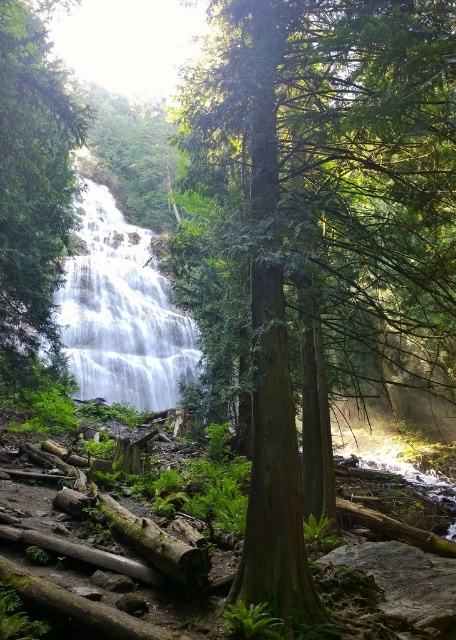
You are a hiker who wants to take a photo of the green smooth tree at center. To avoid getting wet from the white smooth waterfall at center, where should you stand relative to the tree?

The green smooth tree at center is positioned under the white smooth waterfall at center, so to avoid getting wet, you should stand behind the tree or to the side of it, away from the waterfall spray.

You are a hiker standing at the edge of the forest, looking at the green smooth tree at center. If you want to take a photo of it, will you need to zoom in or zoom out your camera to focus on the tree?

The green smooth tree at center is 3.24 meters away from you. Since this distance is relatively close, you would need to zoom out to focus on the entire tree without cropping it out of the frame.